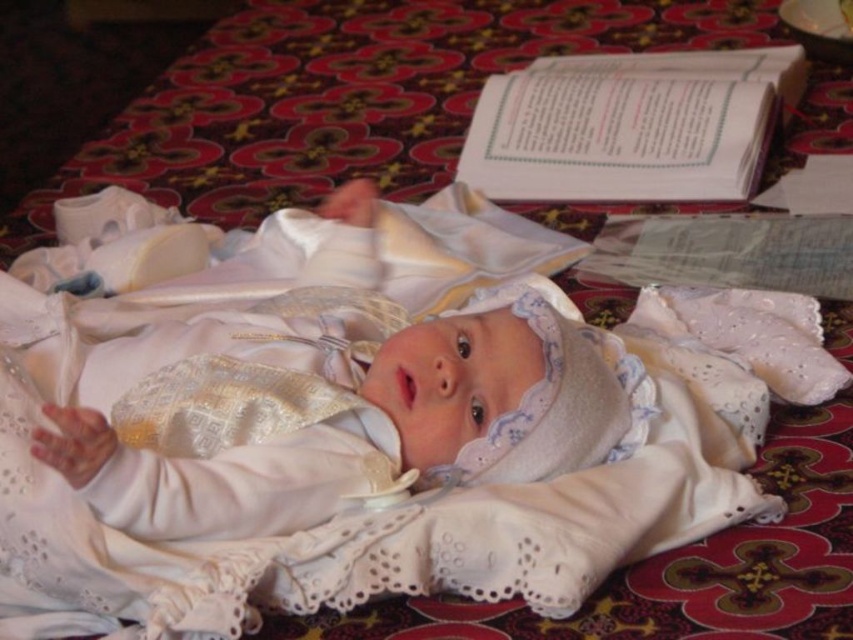
Question: Which of the following is the farthest from the observer?

Choices:
 (A) (289, 445)
 (B) (1, 556)

Answer: (A)

Question: Can you confirm if white lace cloth at center is positioned above white satin baby at center?

Choices:
 (A) no
 (B) yes

Answer: (B)

Question: Is white lace cloth at center smaller than white satin baby at center?

Choices:
 (A) no
 (B) yes

Answer: (A)

Question: Is white lace cloth at center closer to the viewer compared to white satin baby at center?

Choices:
 (A) yes
 (B) no

Answer: (B)

Question: Which of the following is the closest to the observer?

Choices:
 (A) white satin baby at center
 (B) white lace cloth at center

Answer: (A)

Question: Which object appears closest to the camera in this image?

Choices:
 (A) white lace cloth at center
 (B) white satin baby at center

Answer: (B)